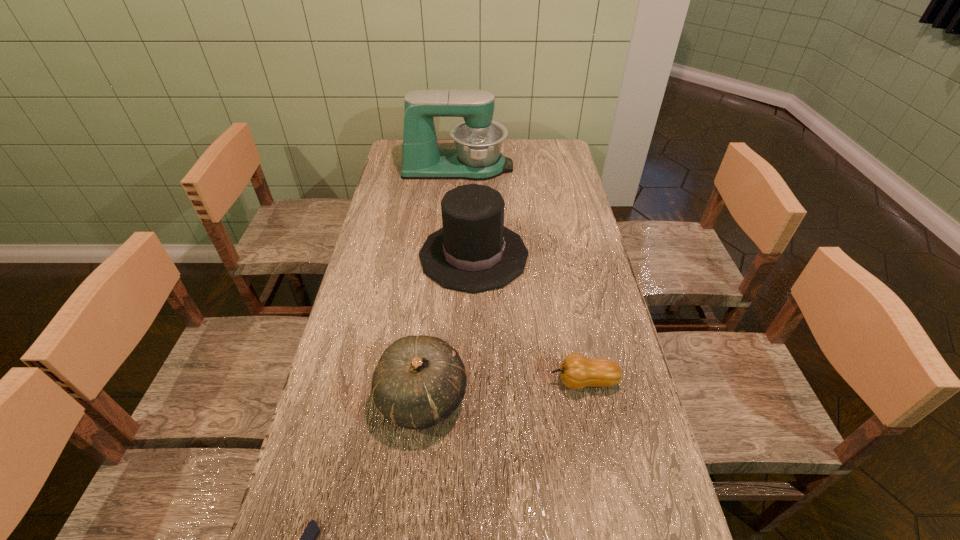
Where is `free space located on the right of the third shortest object`? free space located on the right of the third shortest object is located at coordinates (637, 397).

What are the coordinates of `vacant space located on the stem side of the right gourd` in the screenshot? It's located at (472, 381).

Where is `vacant space located 0.150m on the stem side of the right gourd`? The height and width of the screenshot is (540, 960). vacant space located 0.150m on the stem side of the right gourd is located at coordinates (489, 381).

In order to click on vacant space situated 0.060m on the stem side of the right gourd in this screenshot , I will do `click(526, 381)`.

Find the location of a particular element. object present at the far edge is located at coordinates (478, 140).

Where is `mixer present at the left edge`? Image resolution: width=960 pixels, height=540 pixels. mixer present at the left edge is located at coordinates (478, 140).

Locate an element on the screen. The width and height of the screenshot is (960, 540). gourd that is at the left edge is located at coordinates (419, 381).

The height and width of the screenshot is (540, 960). Identify the location of object present at the right edge. (576, 371).

Where is `object that is positioned at the far left corner`? The image size is (960, 540). object that is positioned at the far left corner is located at coordinates (478, 140).

Find the location of a particular element. The height and width of the screenshot is (540, 960). free point at the far edge is located at coordinates (516, 165).